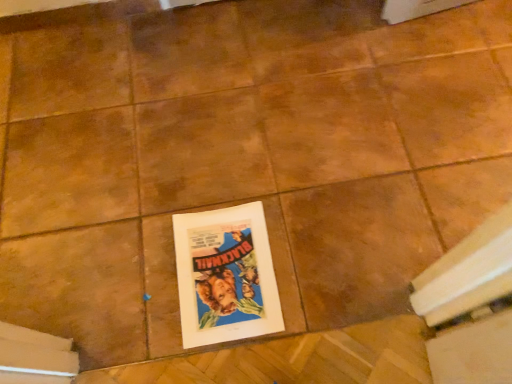
The height and width of the screenshot is (384, 512). What are the coordinates of `vacant region above matte paper poster at center (from a real-world perspective)` in the screenshot? It's located at (222, 262).